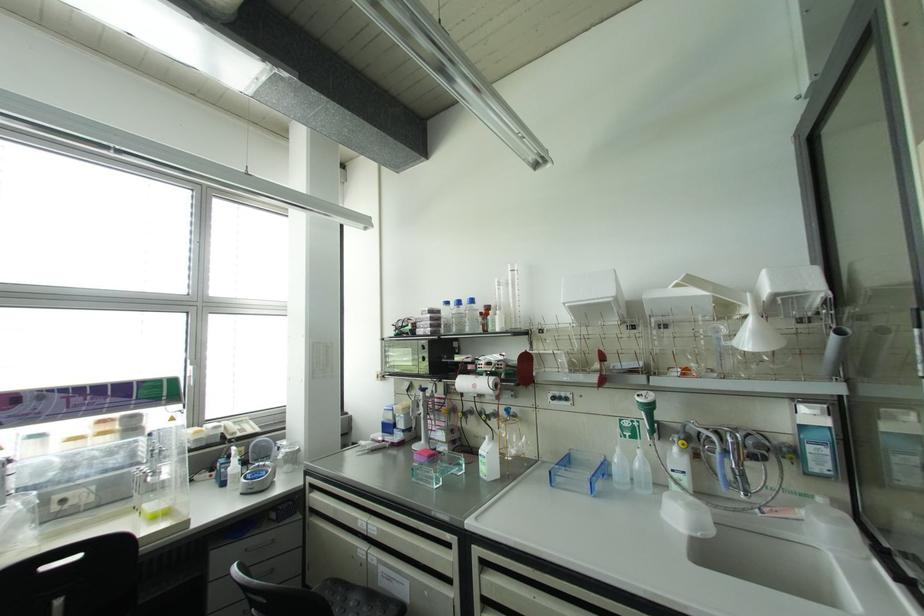
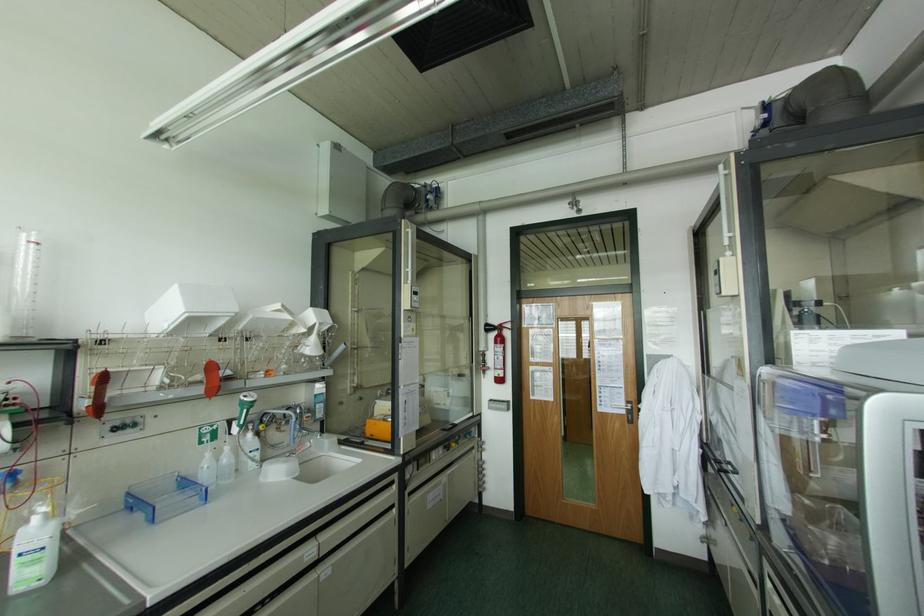
Where in the second image is the point corresponding to point 568,455 from the first image?

(128, 493)